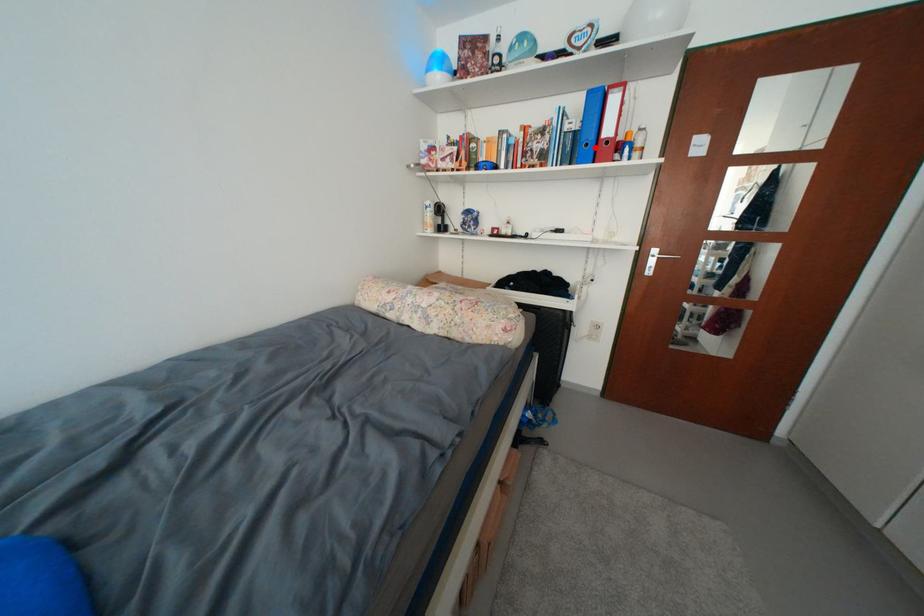
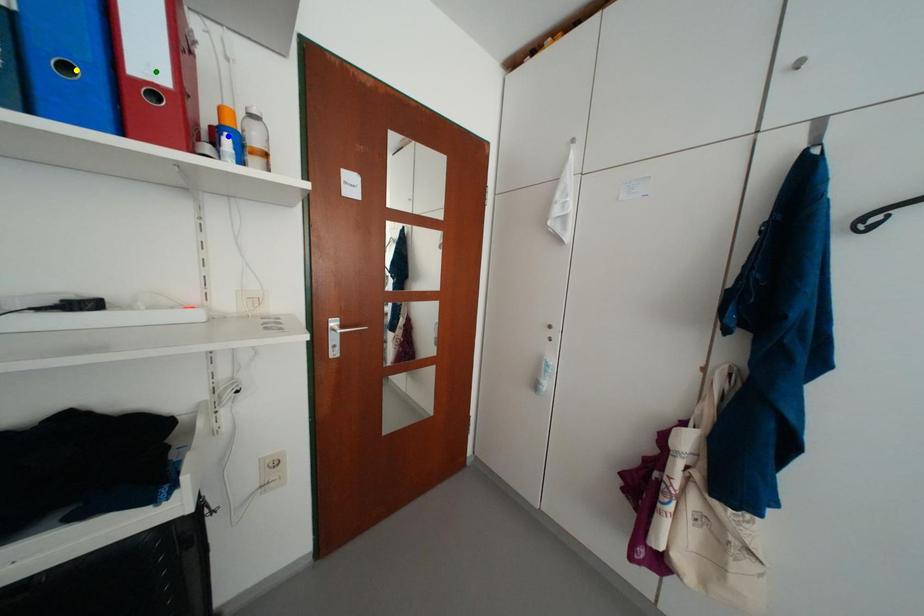
Question: I am providing you with two images of the same scene from different viewpoints. A red point is marked on the first image. You are given multiple points on the second image. Which spot in image 2 lines up with the point in image 1?

Choices:
 (A) blue point
 (B) yellow point
 (C) green point

Answer: (B)